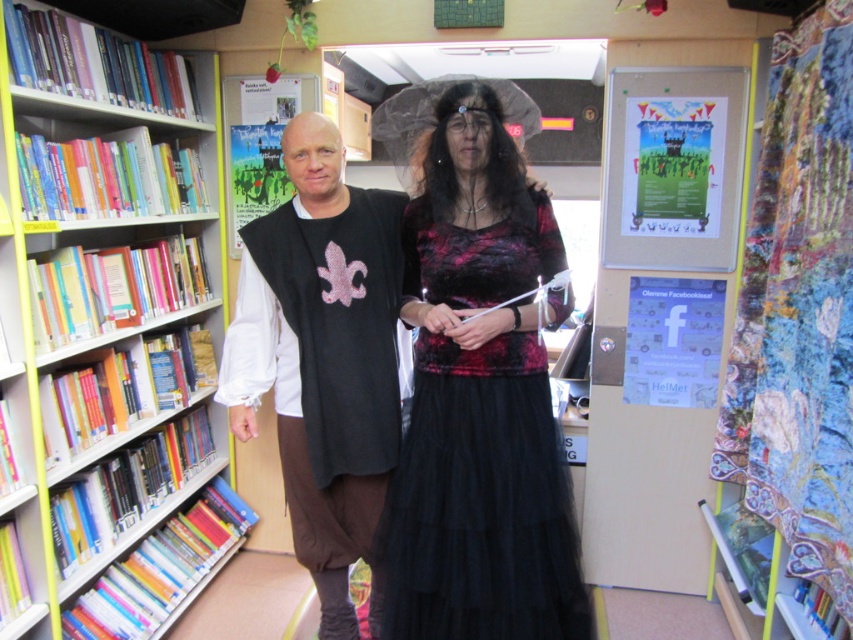
Question: Is multicolored paper bookshelf at left closer to camera compared to velvet-like black dress at center?

Choices:
 (A) yes
 (B) no

Answer: (B)

Question: Which of the following is the closest to the observer?

Choices:
 (A) velvet black dress at center
 (B) multicolored paper bookshelf at left

Answer: (A)

Question: Does velvet black dress at center come behind velvet-like black dress at center?

Choices:
 (A) yes
 (B) no

Answer: (B)

Question: Which point is farther from the camera taking this photo?

Choices:
 (A) (131, 420)
 (B) (257, 296)

Answer: (A)

Question: Can you confirm if velvet black dress at center is positioned to the left of velvet-like black dress at center?

Choices:
 (A) no
 (B) yes

Answer: (B)

Question: Which of the following is the farthest from the observer?

Choices:
 (A) (409, 492)
 (B) (389, 221)
 (C) (86, 332)

Answer: (C)